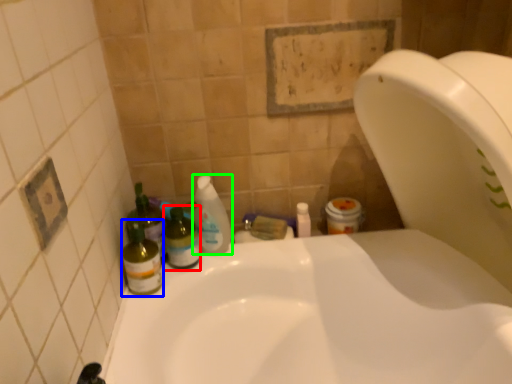
Question: Based on their relative distances, which object is farther from bottle (highlighted by a red box)? Choose from bottle (highlighted by a blue box) and cleaning product (highlighted by a green box).

Choices:
 (A) bottle
 (B) cleaning product

Answer: (A)